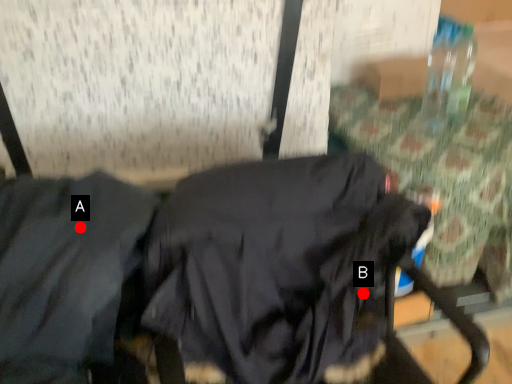
Question: Two points are circled on the image, labeled by A and B beside each circle. Which point is closer to the camera?

Choices:
 (A) A is closer
 (B) B is closer

Answer: (A)